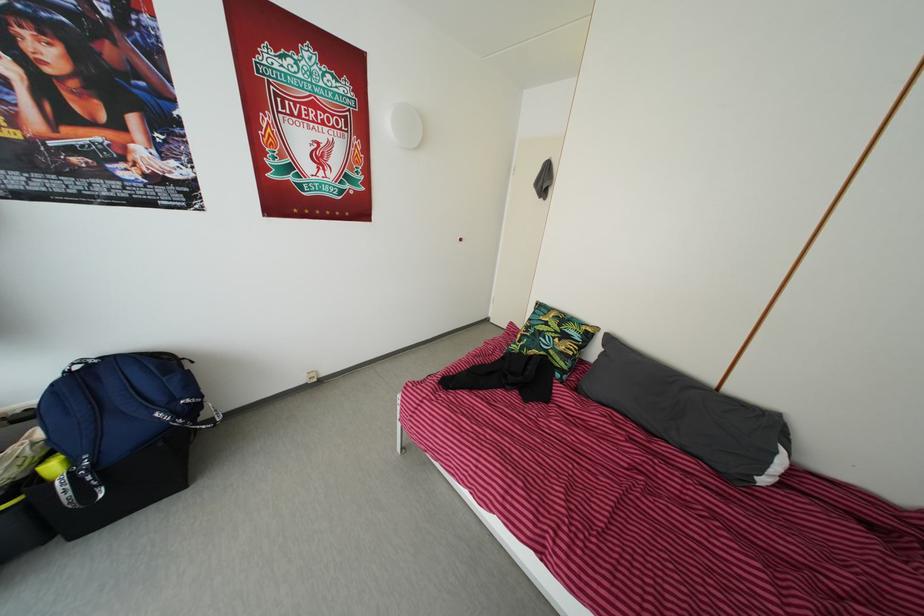
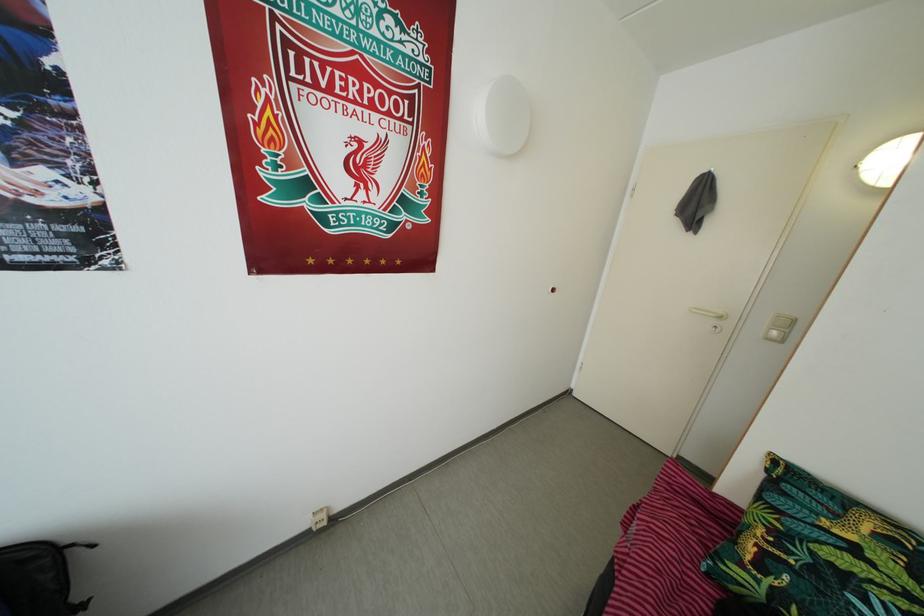
What movement of the cameraman would produce the second image?

The cameraman moved toward left, forward.